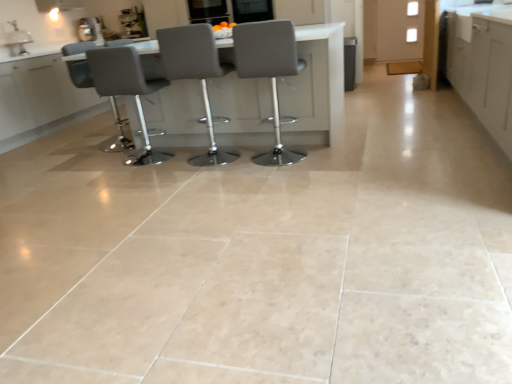
Question: In which direction should I rotate to look at matte gray chair at center, arranged as the second chair when viewed from the right?

Choices:
 (A) right
 (B) left

Answer: (B)

Question: From a real-world perspective, is white glossy sink at upper left physically below white matte cabinet at right, arranged as the 2th cabinetry when viewed from the back?

Choices:
 (A) yes
 (B) no

Answer: (B)

Question: Can you confirm if white glossy sink at upper left is thinner than white matte cabinet at right, which is counted as the first cabinetry, starting from the bottom?

Choices:
 (A) no
 (B) yes

Answer: (B)

Question: Could you tell me if white glossy sink at upper left is facing white matte cabinet at right, the 2th cabinetry viewed from the top?

Choices:
 (A) no
 (B) yes

Answer: (B)

Question: Considering the relative sizes of white glossy sink at upper left and white matte cabinet at right, positioned as the first cabinetry in front-to-back order, in the image provided, is white glossy sink at upper left bigger than white matte cabinet at right, positioned as the first cabinetry in front-to-back order,?

Choices:
 (A) yes
 (B) no

Answer: (B)

Question: Is white glossy sink at upper left not within white matte cabinet at right, arranged as the 2th cabinetry when viewed from the back?

Choices:
 (A) yes
 (B) no

Answer: (A)

Question: Is white glossy sink at upper left smaller than white matte cabinet at right, arranged as the 2th cabinetry when viewed from the back?

Choices:
 (A) yes
 (B) no

Answer: (A)

Question: From a real-world perspective, is gray leather stool at center, placed as the 4th chair when sorted from left to right, under metallic silver coffee machine at upper left?

Choices:
 (A) yes
 (B) no

Answer: (A)

Question: Is metallic silver coffee machine at upper left at the back of gray leather stool at center, the 1th chair from the right?

Choices:
 (A) yes
 (B) no

Answer: (B)

Question: Is gray leather stool at center, the 1th chair from the right, positioned far away from metallic silver coffee machine at upper left?

Choices:
 (A) no
 (B) yes

Answer: (B)

Question: Is gray leather stool at center, placed as the 4th chair when sorted from left to right, aimed at metallic silver coffee machine at upper left?

Choices:
 (A) yes
 (B) no

Answer: (B)

Question: Would you say gray leather stool at center, placed as the 4th chair when sorted from left to right, contains metallic silver coffee machine at upper left?

Choices:
 (A) no
 (B) yes

Answer: (A)

Question: Does gray leather stool at center, the 1th chair from the right, have a larger size compared to metallic silver coffee machine at upper left?

Choices:
 (A) yes
 (B) no

Answer: (A)

Question: Is matte gray table at center with gray leather stool at center, placed as the 4th chair when sorted from left to right?

Choices:
 (A) no
 (B) yes

Answer: (A)